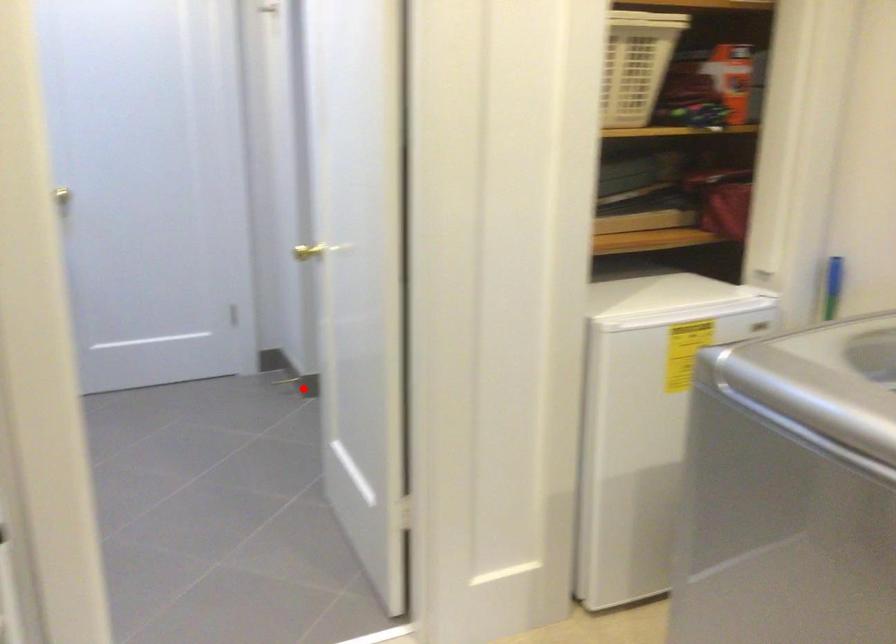
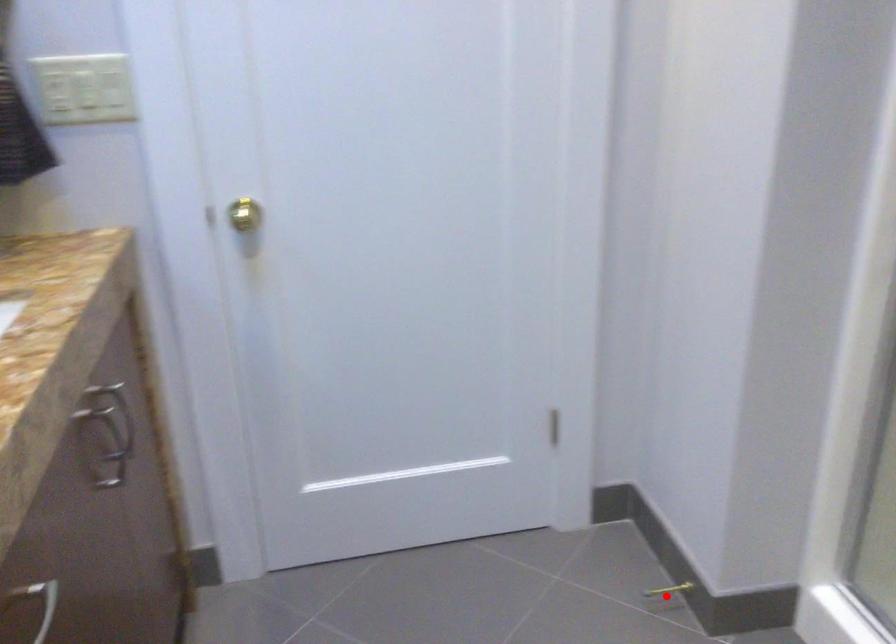
I am providing you with two images of the same scene from different viewpoints. A red point is marked on the first image and another point is marked on the second image. Do the highlighted points in image1 and image2 indicate the same real-world spot?

Yes